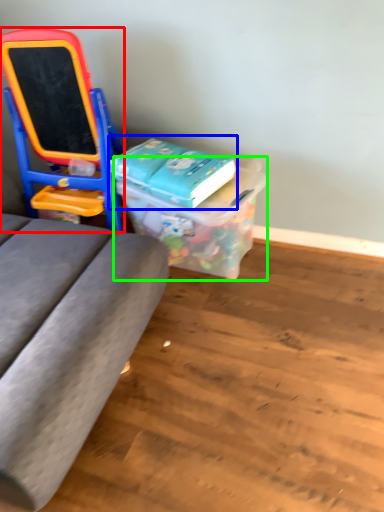
Question: Based on their relative distances, which object is nearer to furniture (highlighted by a red box)? Choose from book (highlighted by a blue box) and box (highlighted by a green box).

Choices:
 (A) book
 (B) box

Answer: (A)